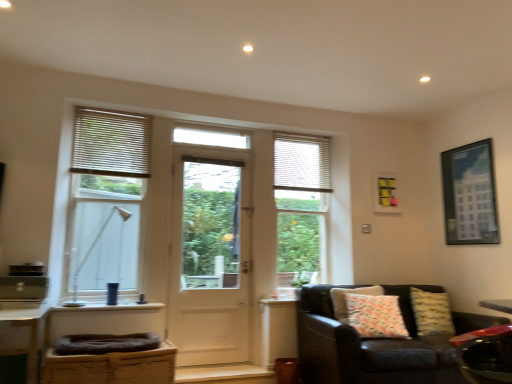
Question: From the image's perspective, is brown woven basket at lower left, marked as the 1th swivel chair in a back-to-front arrangement, located above yellow textured pillow at lower right, the 2th pillow when ordered from left to right?

Choices:
 (A) no
 (B) yes

Answer: (A)

Question: Does brown woven basket at lower left, the second swivel chair in the front-to-back sequence, contain yellow textured pillow at lower right, the 2th pillow when ordered from left to right?

Choices:
 (A) no
 (B) yes

Answer: (A)

Question: Is brown woven basket at lower left, arranged as the first swivel chair when ordered from the bottom, taller than yellow textured pillow at lower right, the first pillow positioned from the right?

Choices:
 (A) yes
 (B) no

Answer: (B)

Question: Is brown woven basket at lower left, arranged as the first swivel chair when ordered from the bottom, with yellow textured pillow at lower right, the first pillow positioned from the right?

Choices:
 (A) no
 (B) yes

Answer: (A)

Question: Is brown woven basket at lower left, the 2th swivel chair when ordered from top to bottom, facing towards yellow textured pillow at lower right, the 2th pillow when ordered from left to right?

Choices:
 (A) yes
 (B) no

Answer: (B)

Question: Can you confirm if brown woven basket at lower left, the 2th swivel chair when ordered from top to bottom, is bigger than yellow textured pillow at lower right, the 2th pillow when ordered from left to right?

Choices:
 (A) no
 (B) yes

Answer: (B)

Question: Is clear glass window at left, the 2th window in the right-to-left sequence, positioned in front of metallic red swivel chair at lower right, acting as the second swivel chair starting from the back?

Choices:
 (A) no
 (B) yes

Answer: (A)

Question: Is clear glass window at left, positioned as the first window in front-to-back order, looking in the opposite direction of metallic red swivel chair at lower right, which is counted as the second swivel chair, starting from the bottom?

Choices:
 (A) no
 (B) yes

Answer: (A)

Question: From a real-world perspective, is clear glass window at left, the 2th window in the right-to-left sequence, on top of metallic red swivel chair at lower right, the 1th swivel chair viewed from the right?

Choices:
 (A) yes
 (B) no

Answer: (A)

Question: Could you tell me if clear glass window at left, the 3th window positioned from the back, is turned towards metallic red swivel chair at lower right, the first swivel chair from the front?

Choices:
 (A) no
 (B) yes

Answer: (A)

Question: Is clear glass window at left, the 3th window positioned from the back, outside of metallic red swivel chair at lower right, which is counted as the second swivel chair, starting from the bottom?

Choices:
 (A) no
 (B) yes

Answer: (B)

Question: Is clear glass window at left, positioned as the first window in front-to-back order, behind metallic red swivel chair at lower right, the 1th swivel chair viewed from the right?

Choices:
 (A) yes
 (B) no

Answer: (A)

Question: Is leather couch at lower right outside white matte blinds at upper left?

Choices:
 (A) yes
 (B) no

Answer: (A)